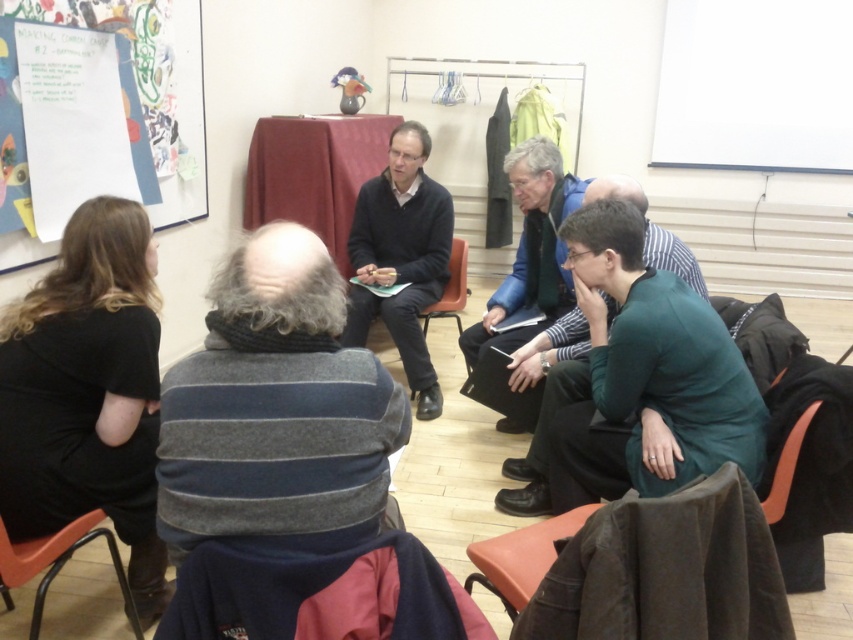
Question: Which point is closer to the camera?

Choices:
 (A) (541, 477)
 (B) (450, 268)
 (C) (54, 10)

Answer: (C)

Question: Does white paper at upper left have a lesser width compared to orange plastic chair at lower left?

Choices:
 (A) yes
 (B) no

Answer: (B)

Question: Estimate the real-world distances between objects in this image. Which object is closer to the orange plastic chair at center?

Choices:
 (A) black matte sweater at center
 (B) green matte shirt at center
 (C) orange plastic chair at lower left

Answer: (A)

Question: Does green matte shirt at center have a larger size compared to orange plastic chair at center?

Choices:
 (A) no
 (B) yes

Answer: (B)

Question: Is white paper at upper left smaller than green fabric chair at lower right?

Choices:
 (A) yes
 (B) no

Answer: (B)

Question: Based on their relative distances, which object is farther from the orange plastic chair at center?

Choices:
 (A) black matte sweater at center
 (B) orange plastic chair at lower left
 (C) green fabric chair at lower right

Answer: (B)